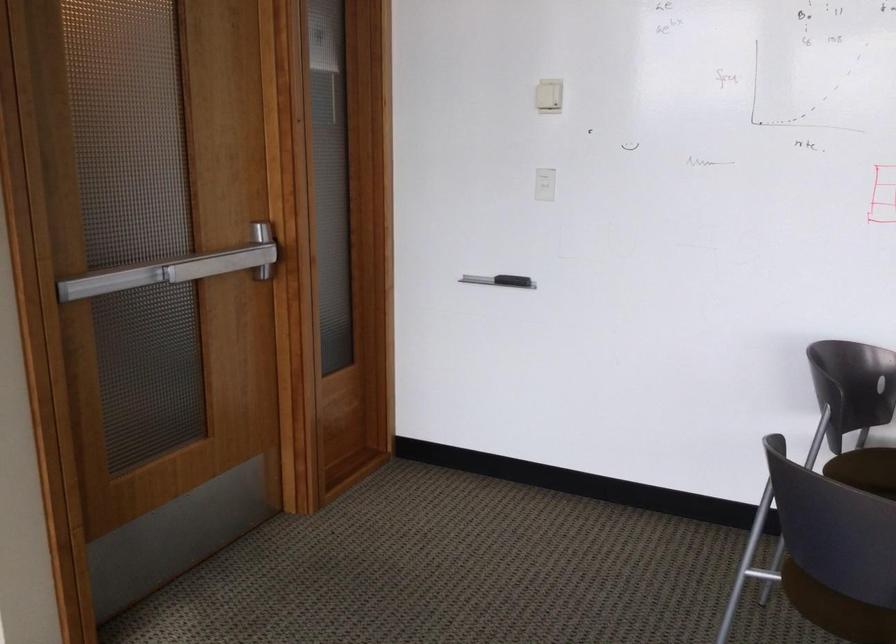
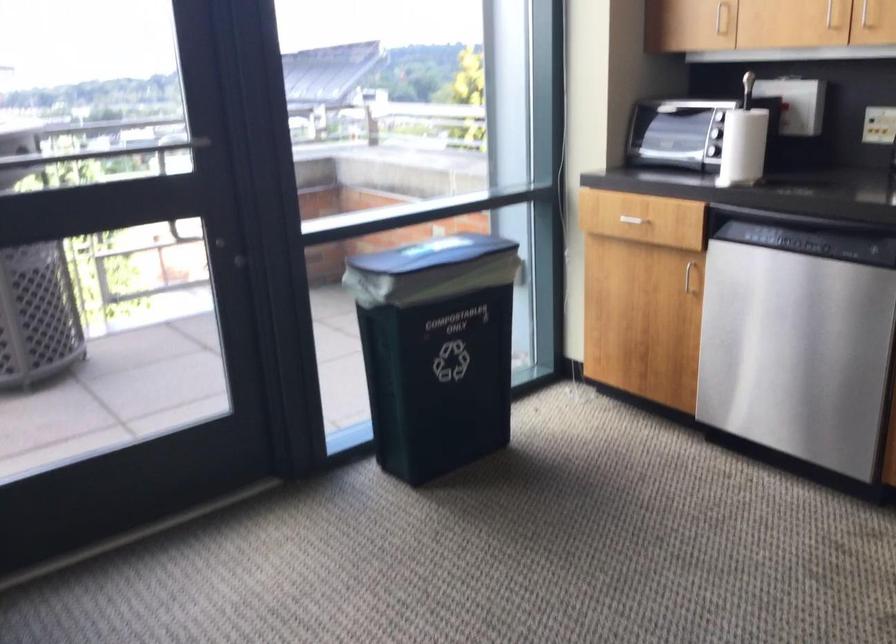
How did the camera likely rotate?

The camera rotated toward left-down.